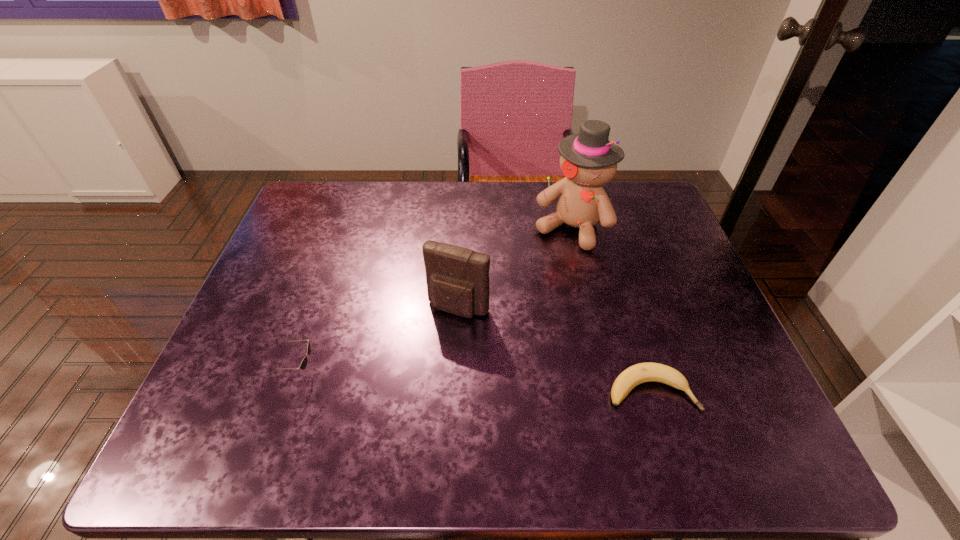
The height and width of the screenshot is (540, 960). What are the coordinates of `free space on the desktop that is between the sunglasses and the banana and is positioned on the front-facing side of the farthest object` in the screenshot? It's located at (477, 381).

Image resolution: width=960 pixels, height=540 pixels. In order to click on free space on the desktop that is between the sunglasses and the shortest object and is positioned with an open flap on the third shortest object in this screenshot , I will do `click(422, 378)`.